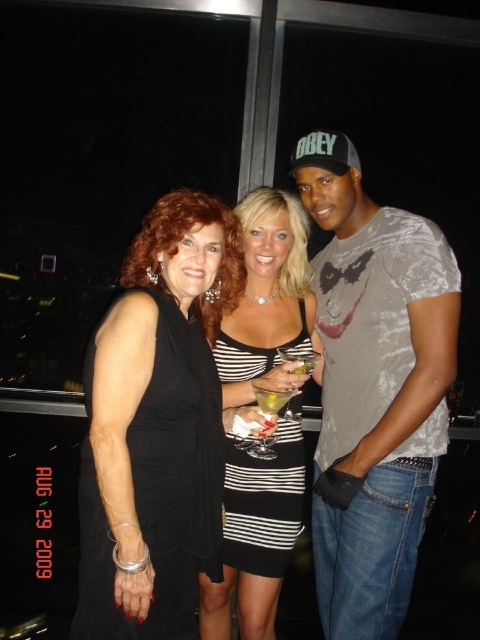
Can you confirm if gray printed t-shirt at center is shorter than black satin dress at center?

Incorrect, gray printed t-shirt at center's height does not fall short of black satin dress at center's.

The width and height of the screenshot is (480, 640). I want to click on gray printed t-shirt at center, so click(373, 388).

Locate an element on the screen. The width and height of the screenshot is (480, 640). gray printed t-shirt at center is located at coordinates (373, 388).

Can you confirm if striped fabric dress at center is taller than translucent glass drink at center?

Yes, striped fabric dress at center is taller than translucent glass drink at center.

Is point (290, 218) closer to viewer compared to point (264, 406)?

No, (290, 218) is behind (264, 406).

The image size is (480, 640). Identify the location of striped fabric dress at center. (267, 300).

Find the location of a particular element. This screenshot has width=480, height=640. striped fabric dress at center is located at coordinates [x=267, y=300].

Who is more forward, (430, 289) or (276, 392)?

Point (430, 289) is in front.

Does gray printed t-shirt at center appear on the right side of translucent glass drink at center?

Correct, you'll find gray printed t-shirt at center to the right of translucent glass drink at center.

Does point (338, 552) lie in front of point (287, 397)?

No, (338, 552) is behind (287, 397).

What are the coordinates of `gray printed t-shirt at center` in the screenshot? It's located at (373, 388).